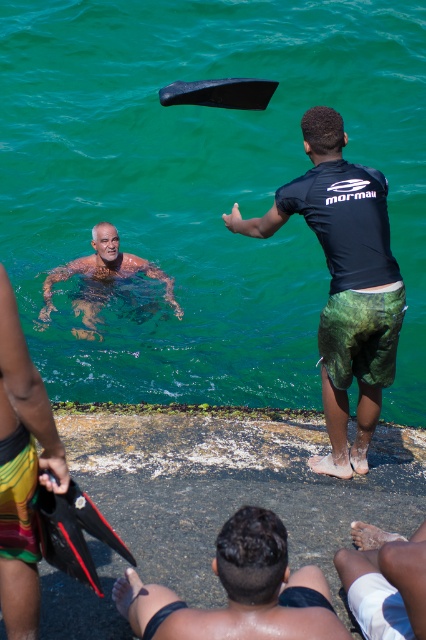
Question: Which object is closer to the camera taking this photo?

Choices:
 (A) black matte wetsuit at center
 (B) white skin at lower right
 (C) multicolored fabric shorts at lower left
 (D) green water at upper center

Answer: (C)

Question: Can you confirm if black matte wetsuit at center is smaller than smooth skin man at center?

Choices:
 (A) yes
 (B) no

Answer: (B)

Question: Which point is closer to the camera taking this photo?

Choices:
 (A) (108, 269)
 (B) (129, 97)

Answer: (A)

Question: Does white skin at lower right have a larger size compared to smooth skin man at center?

Choices:
 (A) no
 (B) yes

Answer: (A)

Question: Estimate the real-world distances between objects in this image. Which object is farther from the white skin at lower right?

Choices:
 (A) black matte wetsuit at center
 (B) dark brown skin at lower center
 (C) green water at upper center

Answer: (C)

Question: Does green water at upper center appear on the left side of white skin at lower right?

Choices:
 (A) no
 (B) yes

Answer: (B)